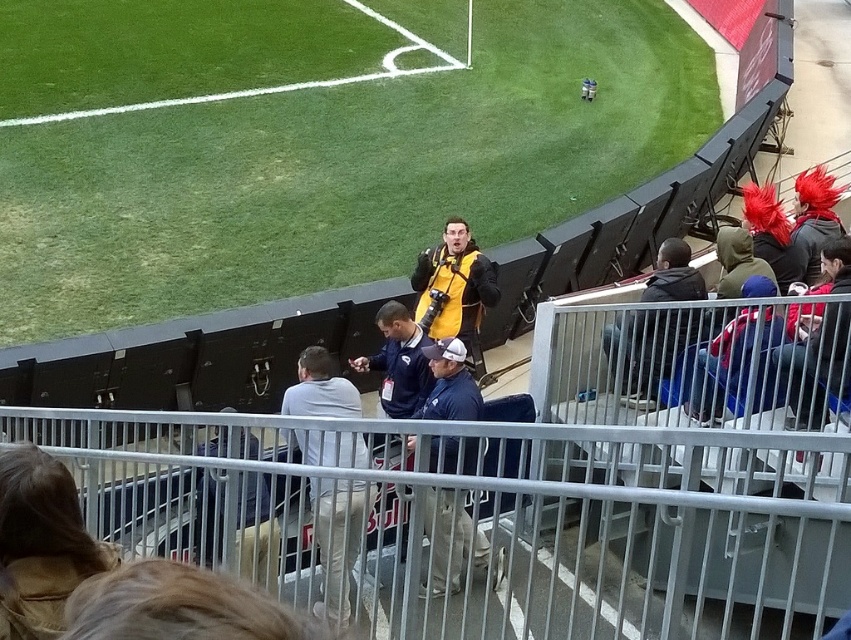
You are standing at the point marked as point (27, 515) in the stadium. You want to take a photo of the soccer field. The camera you have can focus on objects up to 5 meters away. Will the camera be able to capture the field clearly?

The distance from point (27, 515) to the camera is 4.86 meters, which is within the camera focus range of 5 meters. Therefore, the camera can capture the field clearly.

You are a photographer standing at the edge of the stadium seats. You notice the green grass at center and the metal at center in your viewfinder. Which object is closer to the left side of your frame?

The green grass at center is positioned on the left side of metal at center, so it is closer to the left side of your frame.

You are a photographer at the stadium. You need to take a photo of the soccer match. There are two people in your frame wearing jackets. The brown leather jacket at lower left and the dark blue jacket at center. Which jacket is positioned to the left of the other?

The brown leather jacket at lower left is to the left of the dark blue jacket at center.